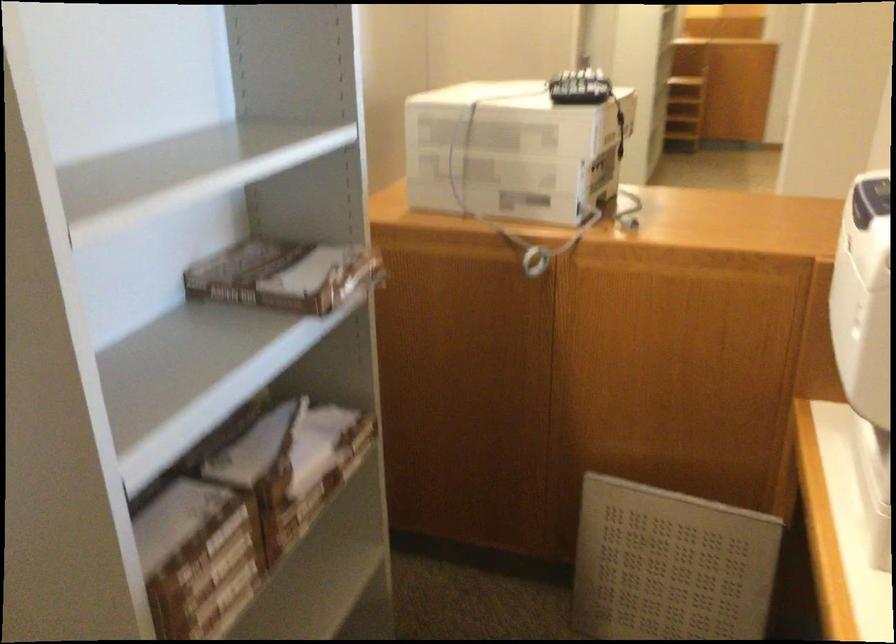
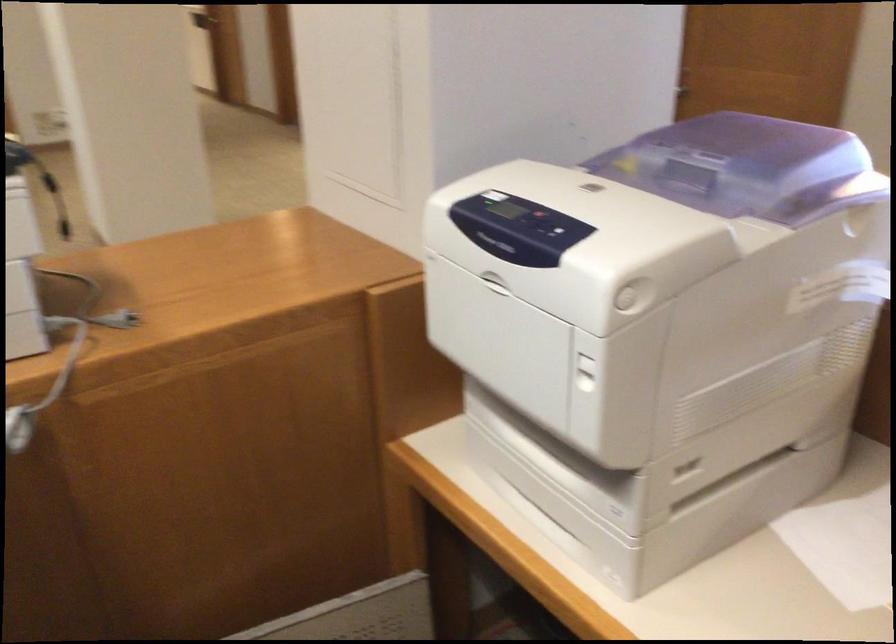
Question: The camera is either moving clockwise (left) or counter-clockwise (right) around the object. The first image is from the beginning of the video and the second image is from the end. Is the camera moving left or right when shooting the video?

Choices:
 (A) Left
 (B) Right

Answer: (A)